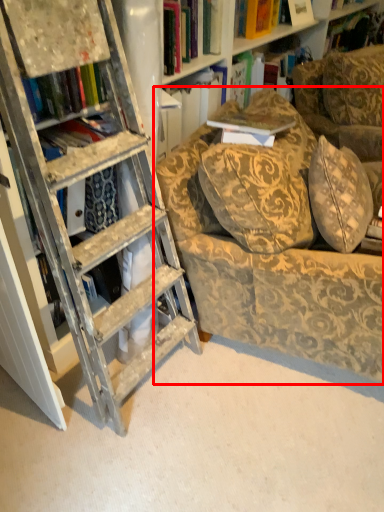
Question: Observing the image, what is the correct spatial positioning of chair (annotated by the red box) in reference to book?

Choices:
 (A) right
 (B) left

Answer: (B)